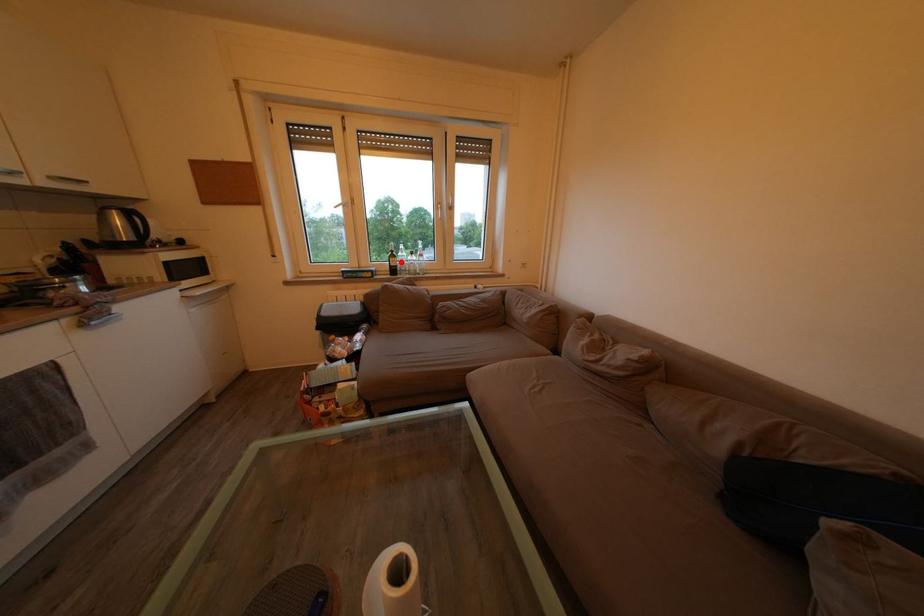
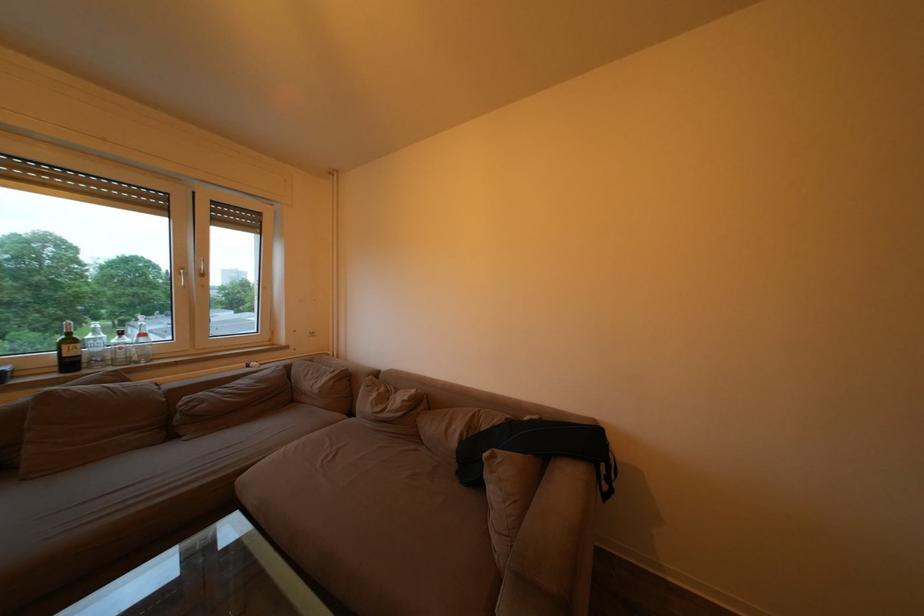
The point at the highlighted location is marked in the first image. Where is the corresponding point in the second image?

(79, 347)